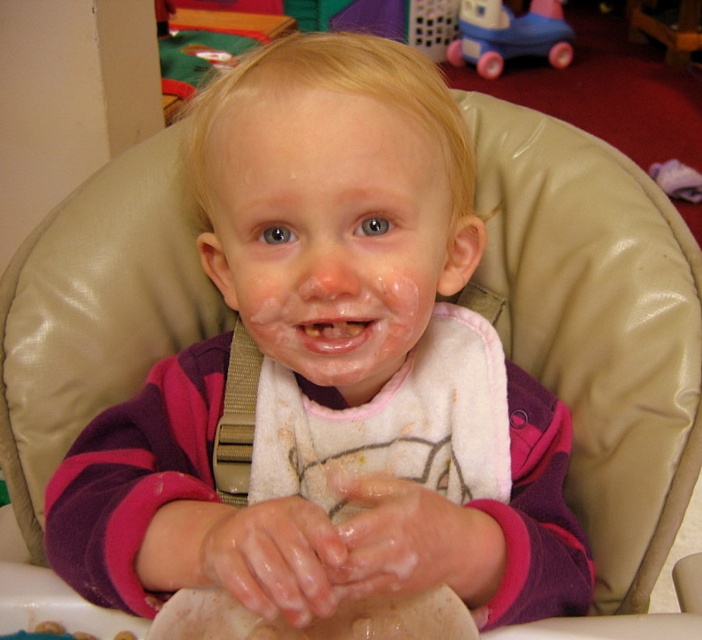
Measure the distance from pink fleece sweater at center to matte plastic toy car at upper right.

They are 12.45 feet apart.

Between pink fleece sweater at center and matte plastic toy car at upper right, which one appears on the right side from the viewer's perspective?

From the viewer's perspective, matte plastic toy car at upper right appears more on the right side.

What are the coordinates of `pink fleece sweater at center` in the screenshot? It's located at (326, 365).

Find the location of a particular element. This screenshot has height=640, width=702. pink fleece sweater at center is located at coordinates (326, 365).

Between point (249, 323) and point (475, 12), which one is positioned in front?

Point (249, 323) is in front.

The image size is (702, 640). I want to click on white matte bib at center, so click(331, 230).

Who is positioned more to the left, pink fleece sweater at center or yellowish matte teeth at center?

pink fleece sweater at center is more to the left.

Can you confirm if pink fleece sweater at center is wider than yellowish matte teeth at center?

Indeed, pink fleece sweater at center has a greater width compared to yellowish matte teeth at center.

What do you see at coordinates (326, 365) in the screenshot? The height and width of the screenshot is (640, 702). I see `pink fleece sweater at center` at bounding box center [326, 365].

The image size is (702, 640). What are the coordinates of `pink fleece sweater at center` in the screenshot? It's located at (326, 365).